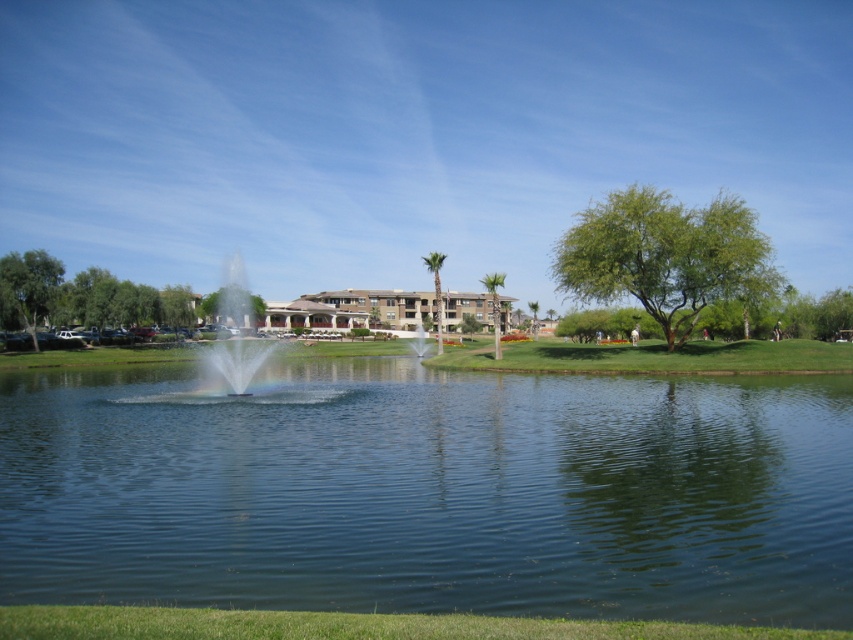
Question: Is green grass at lower center to the right of clear glass fountain at center from the viewer's perspective?

Choices:
 (A) no
 (B) yes

Answer: (B)

Question: Is clear blue water at center thinner than clear glass fountain at center?

Choices:
 (A) no
 (B) yes

Answer: (B)

Question: Which is farther from the clear water fountain at center?

Choices:
 (A) clear blue water at center
 (B) green grass at lower center

Answer: (B)

Question: Is clear blue water at center wider than green grass at lower center?

Choices:
 (A) no
 (B) yes

Answer: (B)

Question: Which object appears closest to the camera in this image?

Choices:
 (A) clear blue water at center
 (B) clear glass fountain at center
 (C) green grass at lower center
 (D) clear water fountain at center

Answer: (C)

Question: Which of the following is the farthest from the observer?

Choices:
 (A) clear blue water at center
 (B) green grass at lower center

Answer: (A)